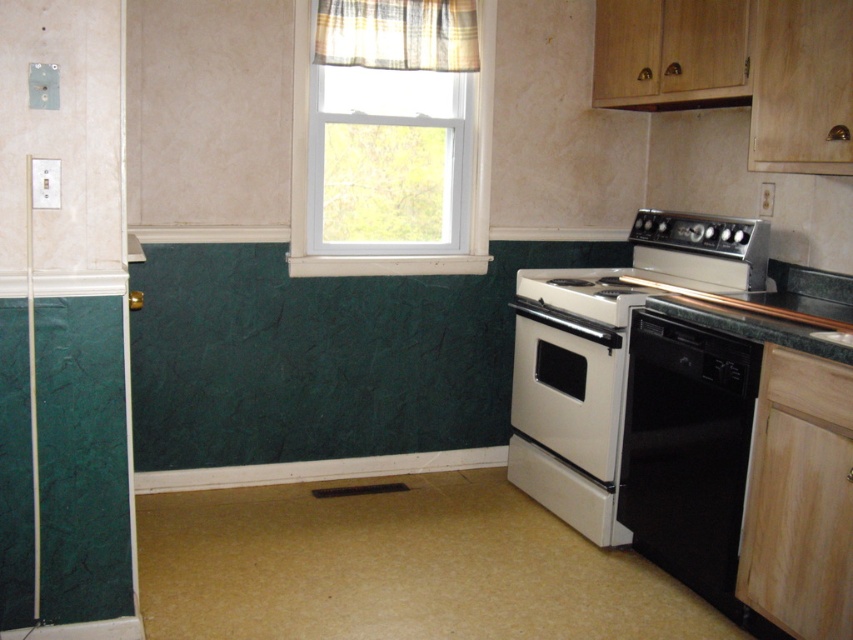
Does black matte dishwasher at lower right appear under matte white exhaust hood at upper center?

Yes, black matte dishwasher at lower right is below matte white exhaust hood at upper center.

Can you confirm if black matte dishwasher at lower right is smaller than matte white exhaust hood at upper center?

No, black matte dishwasher at lower right is not smaller than matte white exhaust hood at upper center.

Is point (704, 545) farther from viewer compared to point (724, 104)?

No, it is not.

Find the location of a particular element. The height and width of the screenshot is (640, 853). black matte dishwasher at lower right is located at coordinates (x=688, y=451).

From the picture: Which is more to the right, white plastic window at upper center or matte white exhaust hood at upper center?

matte white exhaust hood at upper center is more to the right.

Is white plastic window at upper center wider than matte white exhaust hood at upper center?

Correct, the width of white plastic window at upper center exceeds that of matte white exhaust hood at upper center.

The height and width of the screenshot is (640, 853). I want to click on white plastic window at upper center, so click(306, 170).

Does green marble countertop at right have a larger size compared to matte white exhaust hood at upper center?

No.

Measure the distance from green marble countertop at right to matte white exhaust hood at upper center.

The distance of green marble countertop at right from matte white exhaust hood at upper center is 97.53 centimeters.

Does point (732, 317) come closer to viewer compared to point (599, 106)?

That is True.

Where is `green marble countertop at right`? This screenshot has width=853, height=640. green marble countertop at right is located at coordinates (749, 326).